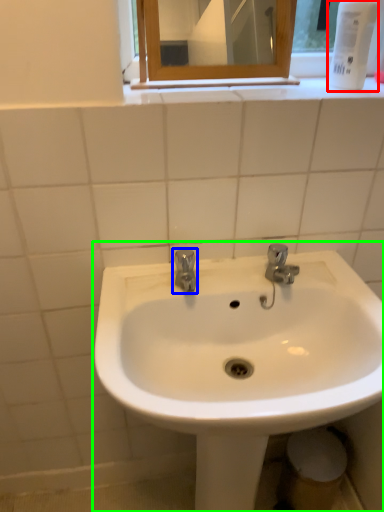
Question: Considering the real-world distances, which object is farthest from mouthwash (highlighted by a red box)? tap (highlighted by a blue box) or sink (highlighted by a green box)?

Choices:
 (A) tap
 (B) sink

Answer: (B)